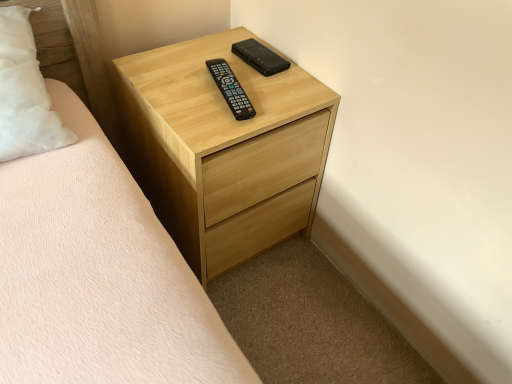
Question: Is black plastic remote at center, the first control in the bottom-to-top sequence, spatially inside light wood chest of drawers at center, or outside of it?

Choices:
 (A) outside
 (B) inside

Answer: (B)

Question: From the image's perspective, is black plastic remote at center, the 2th control positioned from the top, above or below light wood chest of drawers at center?

Choices:
 (A) below
 (B) above

Answer: (B)

Question: Which object is the closest to the black plastic remote at center, the 2th control positioned from the top?

Choices:
 (A) black matte phone at upper center, arranged as the second control when ordered from the bottom
 (B) light wood chest of drawers at center

Answer: (A)

Question: Considering the real-world distances, which object is closest to the light wood chest of drawers at center?

Choices:
 (A) black plastic remote at center, the 2th control positioned from the top
 (B) black matte phone at upper center, which is the 2th control in front-to-back order

Answer: (A)